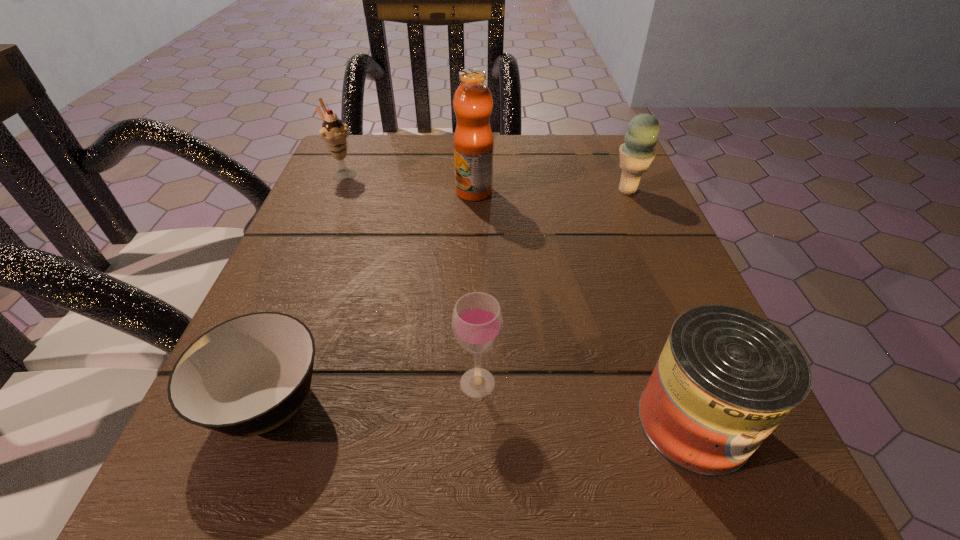
Locate an element on the screen. The image size is (960, 540). free point between the right ice cream and the fruit juice is located at coordinates (551, 191).

This screenshot has width=960, height=540. What are the coordinates of `free area in between the left ice cream and the soup bowl` in the screenshot? It's located at (306, 288).

This screenshot has height=540, width=960. What are the coordinates of `vacant area that lies between the wineglass and the can` in the screenshot? It's located at (586, 402).

You are a GUI agent. You are given a task and a screenshot of the screen. Output one action in this format:
    pyautogui.click(x=<x>, y=<y>)
    Task: Click on the free space between the fruit juice and the left ice cream
    
    Given the screenshot: What is the action you would take?
    pyautogui.click(x=409, y=183)

Locate an element on the screen. This screenshot has width=960, height=540. free space between the tallest object and the left ice cream is located at coordinates (409, 183).

What are the coordinates of `free space between the can and the soup bowl` in the screenshot? It's located at (481, 412).

The width and height of the screenshot is (960, 540). Find the location of `free spot between the wineglass and the can`. free spot between the wineglass and the can is located at coordinates (586, 402).

Where is `free space between the can and the right ice cream`? Image resolution: width=960 pixels, height=540 pixels. free space between the can and the right ice cream is located at coordinates (660, 306).

I want to click on unoccupied position between the left ice cream and the fruit juice, so click(x=409, y=183).

Where is `vacant point located between the soup bowl and the can`? The image size is (960, 540). vacant point located between the soup bowl and the can is located at coordinates [x=481, y=412].